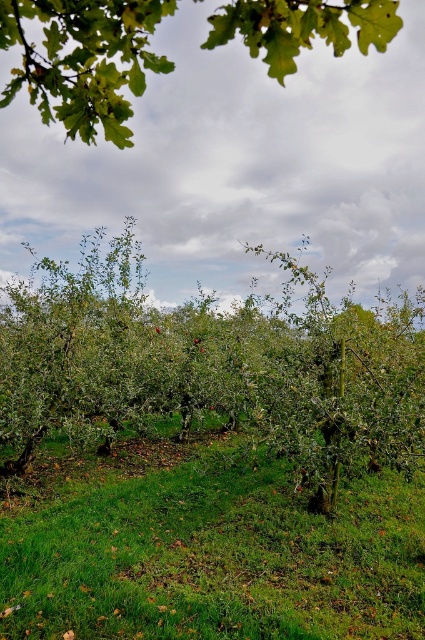
You are standing in the orchard and see two points marked in the image. Which point is closer to you, point (169, 605) or point (292, 449)?

Point (169, 605) is in front of point (292, 449), so it is closer to you.

You are an apple picker observing the orchard scene. You notice the green leafy tree at center and the green leafy branch at upper center. Which one is closer to the ground?

The green leafy tree at center is positioned under the green leafy branch at upper center, so the green leafy tree at center is closer to the ground.